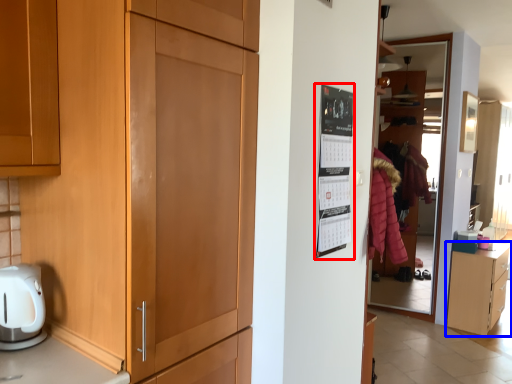
Question: Which of the following is the closest to the observer, bulletin board (highlighted by a red box) or cabinetry (highlighted by a blue box)?

Choices:
 (A) bulletin board
 (B) cabinetry

Answer: (A)